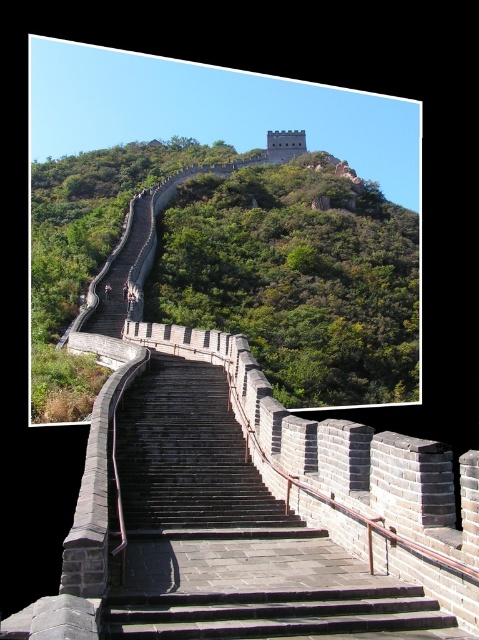
Question: Does dark gray stone stairs at center have a smaller size compared to green stone wall at upper center?

Choices:
 (A) yes
 (B) no

Answer: (A)

Question: Which point is closer to the camera?

Choices:
 (A) green stone wall at upper center
 (B) dark gray stone stairs at center

Answer: (B)

Question: Can you confirm if dark gray stone stairs at center is thinner than green stone wall at upper center?

Choices:
 (A) yes
 (B) no

Answer: (A)

Question: Does dark gray stone stairs at center lie in front of green stone wall at upper center?

Choices:
 (A) yes
 (B) no

Answer: (A)